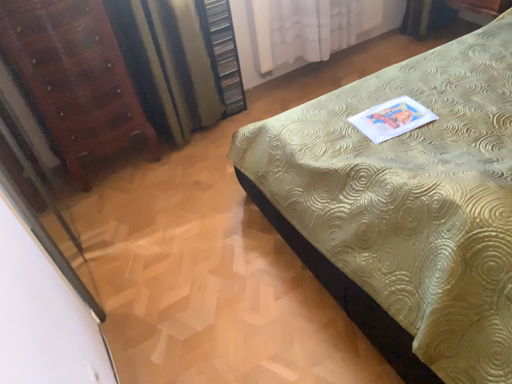
At what (x,y) coordinates should I click in order to perform the action: click on vacant region below mahogany wood dresser at left (from a real-world perspective). Please return your answer as a coordinate pair (x, y). Image resolution: width=512 pixels, height=384 pixels. Looking at the image, I should click on (119, 168).